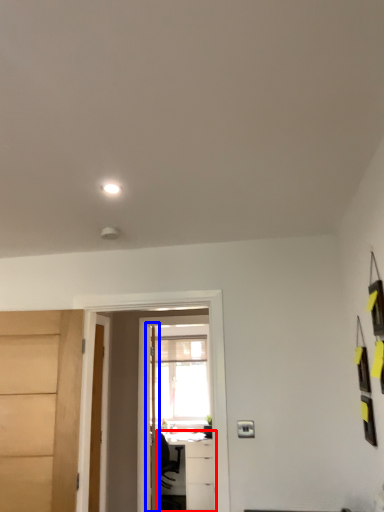
Question: Which object is closer to the camera taking this photo, table (highlighted by a red box) or door (highlighted by a blue box)?

Choices:
 (A) table
 (B) door

Answer: (B)